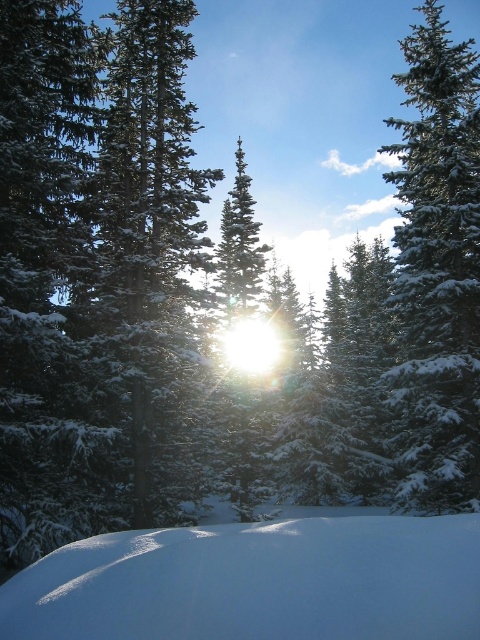
From the picture: You are standing in the winter scene and want to walk from point A to point B. Point A is at coordinates point (479, 618) and point B is at coordinates point (451, 68). Considering the dense trees and snow, which point is closer to you when you start walking?

Point point (479, 618) is in front of point point (451, 68), so when you start walking, point A at point (479, 618) is closer to you than point B at point (451, 68).